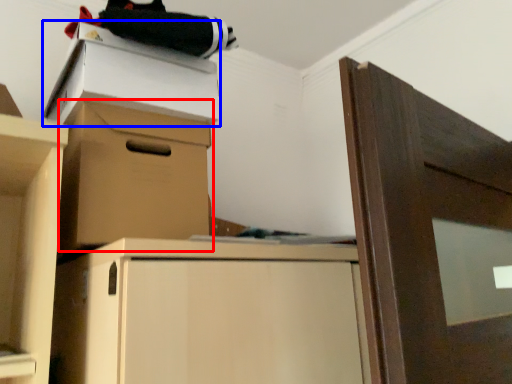
Question: Which object is further to the camera taking this photo, cabinetry (highlighted by a red box) or cardboard box (highlighted by a blue box)?

Choices:
 (A) cabinetry
 (B) cardboard box

Answer: (B)